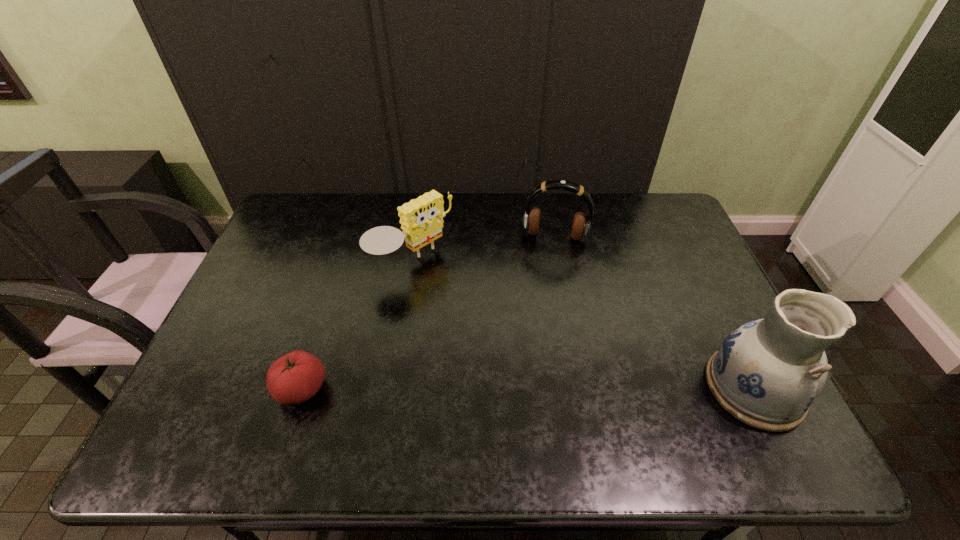
Where is `free space between the rightmost object and the leftmost object`? free space between the rightmost object and the leftmost object is located at coordinates (528, 388).

The height and width of the screenshot is (540, 960). What are the coordinates of `empty location between the third object from right to left and the leftmost object` in the screenshot? It's located at (357, 326).

At what (x,y) coordinates should I click in order to perform the action: click on blank region between the tomato and the second object from right to left. Please return your answer as a coordinate pair (x, y). Looking at the image, I should click on (428, 313).

At what (x,y) coordinates should I click in order to perform the action: click on empty space that is in between the pottery and the headset. Please return your answer as a coordinate pair (x, y). Image resolution: width=960 pixels, height=540 pixels. Looking at the image, I should click on (654, 312).

Select which object appears as the second closest to the second object from right to left. Please provide its 2D coordinates. Your answer should be formatted as a tuple, i.e. [(x, y)], where the tuple contains the x and y coordinates of a point satisfying the conditions above.

[(767, 373)]

I want to click on the third closest object to the headset, so click(x=294, y=378).

Where is `free space that satisfies the following two spatial constraints: 1. on the front side of the tallest object; 2. on the left side of the sponge`? The width and height of the screenshot is (960, 540). free space that satisfies the following two spatial constraints: 1. on the front side of the tallest object; 2. on the left side of the sponge is located at coordinates (393, 388).

This screenshot has height=540, width=960. What are the coordinates of `vacant space that satisfies the following two spatial constraints: 1. on the back side of the second object from right to left; 2. on the left side of the sponge` in the screenshot? It's located at (417, 236).

The height and width of the screenshot is (540, 960). What are the coordinates of `vacant region that satisfies the following two spatial constraints: 1. on the back side of the shortest object; 2. on the left side of the third object from right to left` in the screenshot? It's located at (343, 263).

What are the coordinates of `free space in the image that satisfies the following two spatial constraints: 1. on the front side of the third object from left to right; 2. on the right side of the pottery` in the screenshot? It's located at (583, 388).